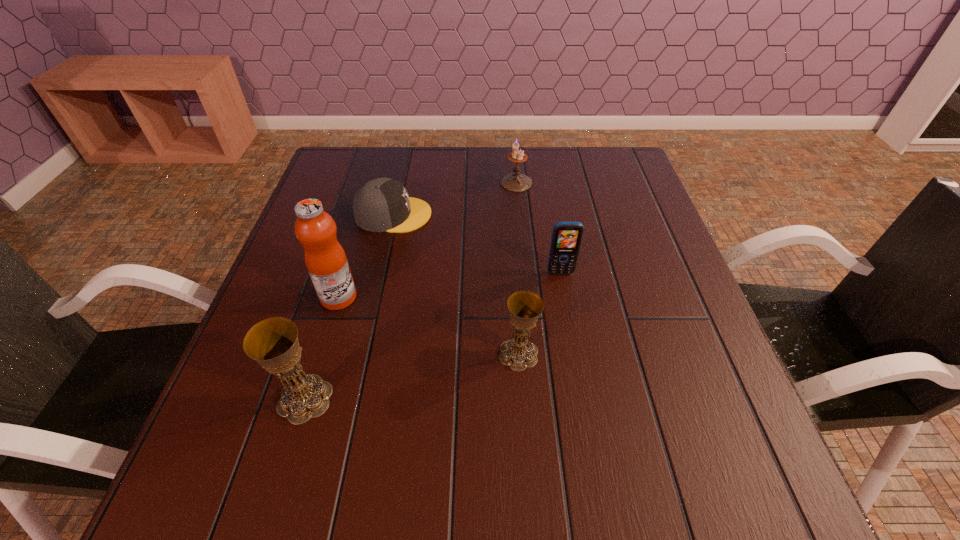
The height and width of the screenshot is (540, 960). Find the location of `empty space that is in between the second tallest object and the third farthest object`. empty space that is in between the second tallest object and the third farthest object is located at coordinates (433, 335).

The image size is (960, 540). Find the location of `unoccupied position between the second nearest object and the candle holder`. unoccupied position between the second nearest object and the candle holder is located at coordinates (517, 268).

Find the location of a particular element. The image size is (960, 540). vacant area that lies between the rightmost object and the taller chalice is located at coordinates (433, 335).

This screenshot has height=540, width=960. I want to click on free space between the fourth farthest object and the cellular telephone, so click(x=449, y=285).

Where is `vacant point located between the taller chalice and the shortest object`? vacant point located between the taller chalice and the shortest object is located at coordinates (349, 307).

Locate an element on the screen. This screenshot has height=540, width=960. free point between the cellular telephone and the fruit juice is located at coordinates (449, 285).

Identify the location of free point between the fifth nearest object and the fifth farthest object. The image size is (960, 540). (456, 284).

Locate an element on the screen. free space between the second tallest object and the candle holder is located at coordinates (411, 291).

I want to click on object that is the fifth closest to the second farthest object, so click(273, 343).

Find the location of a particular element. The height and width of the screenshot is (540, 960). object that stands as the second closest to the fifth farthest object is located at coordinates (273, 343).